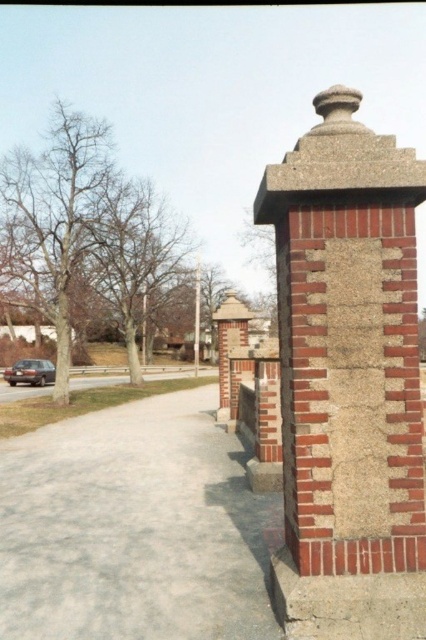
You are standing in front of the brick structure shown in the scene. If you were to draw a straight line from your current position to the red brick chimney at right, would it intersect with any other objects in the scene?

The red brick chimney at right is located at point (348,344). Since there are no other objects mentioned in the scene between your position and the chimney, the straight line would not intersect with any other objects.

You are standing on the gray concrete pavement at lower left and want to walk towards the red brick chimney at right. Which direction should you turn to face the chimney?

The red brick chimney at right is to the right of the gray concrete pavement at lower left. So you should turn to your right to face the chimney.